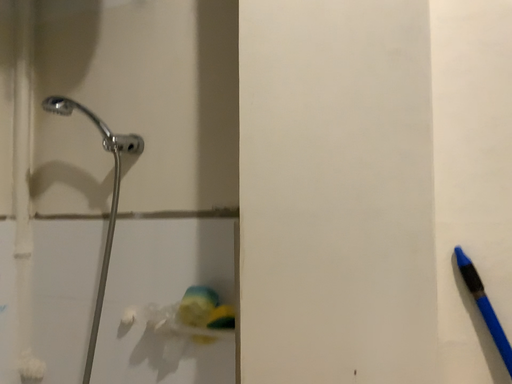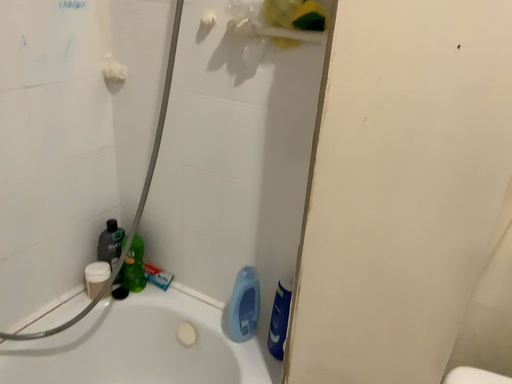
Question: How did the camera likely rotate when shooting the video?

Choices:
 (A) rotated upward
 (B) rotated downward

Answer: (B)